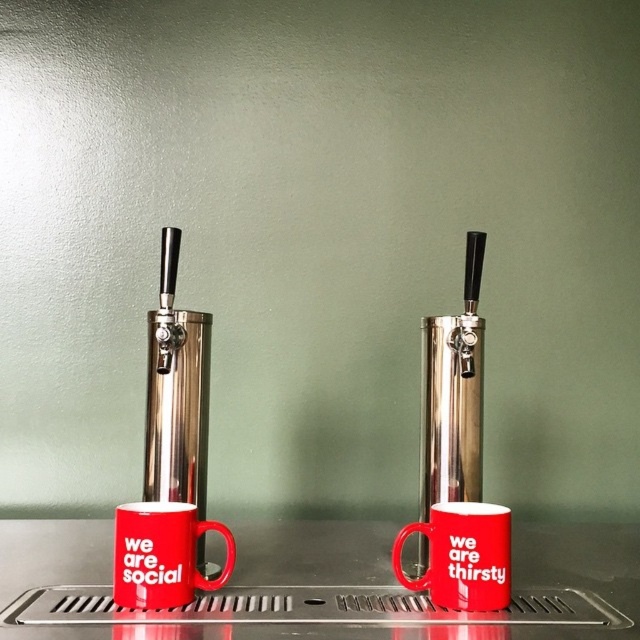
Based on the photo, you are a bartender trying to place a new glass between the metallic stainless steel counter at center and the matte ceramic mug at lower left. The glass you have is 20 centimeters wide. Will it fit in the space between them?

The distance between the metallic stainless steel counter at center and the matte ceramic mug at lower left is 19.31 centimeters, so the glass which is 20 centimeters wide will not fit in the space between them.

You are at a bar and want to choose a mug to drink from. You prefer a taller mug. Which one should you pick between the matte ceramic mug at lower left and the matte red mug at center?

The matte red mug at center is taller than the matte ceramic mug at lower left, so you should pick the matte red mug at center.

You are setting up a bar for a party and need to place a large tray on the metallic stainless steel counter at center. Considering the matte red mug at center is already there, will the tray fit without overlapping the mug?

The metallic stainless steel counter at center is bigger than the matte red mug at center, so the tray should fit as long as it is placed appropriately around the mug.